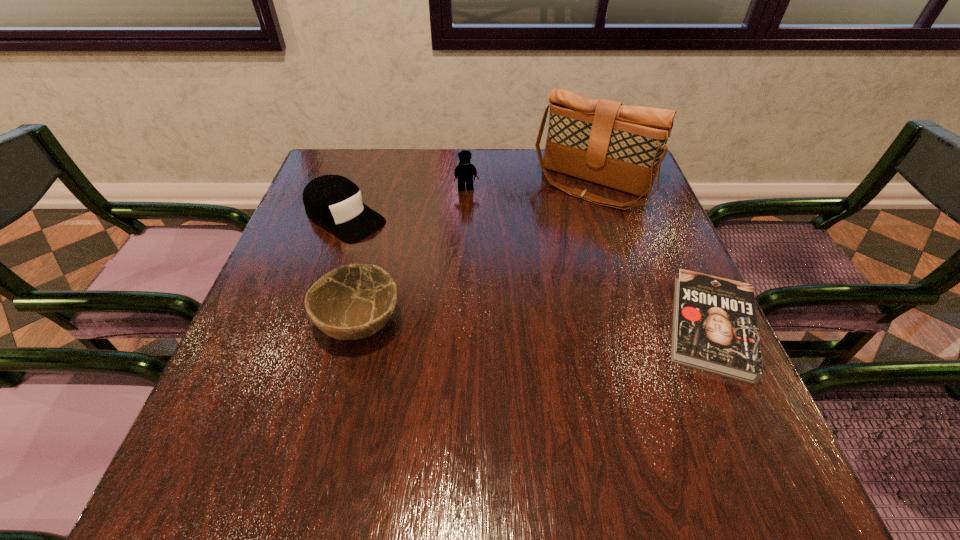
The height and width of the screenshot is (540, 960). Find the location of `free space on the desktop that is between the bowl and the book and is positioned on the front-facing side of the second tallest object`. free space on the desktop that is between the bowl and the book and is positioned on the front-facing side of the second tallest object is located at coordinates (498, 325).

Identify the location of free space on the desktop that is between the bowl and the book and is positioned on the front-facing side of the shoulder bag. The width and height of the screenshot is (960, 540). (494, 325).

The image size is (960, 540). Find the location of `free space on the desktop that is between the bowl and the shortest object and is positioned on the front-facing side of the cap`. free space on the desktop that is between the bowl and the shortest object and is positioned on the front-facing side of the cap is located at coordinates (510, 325).